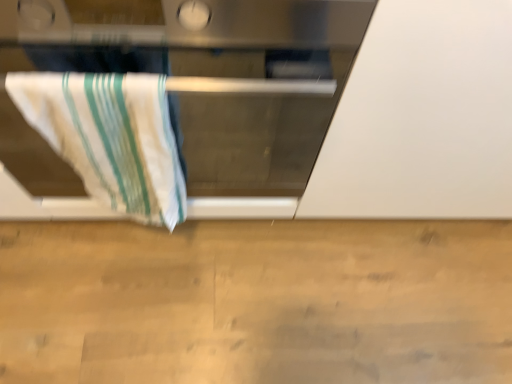
The height and width of the screenshot is (384, 512). I want to click on vacant location below white cotton towel at left (from a real-world perspective), so click(x=158, y=266).